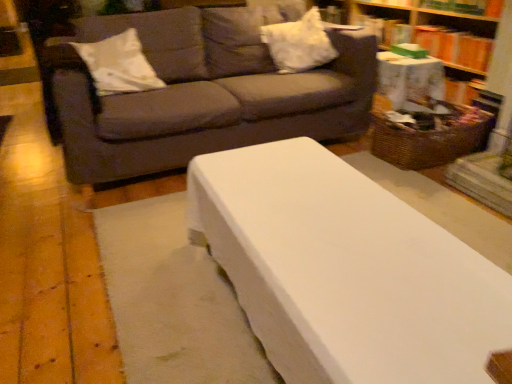
Question: Is point (482, 112) closer or farther from the camera than point (94, 66)?

Choices:
 (A) farther
 (B) closer

Answer: (A)

Question: Is woven brown basket at right wider or thinner than white soft pillow at upper left, which is the first pillow in left-to-right order?

Choices:
 (A) wide
 (B) thin

Answer: (A)

Question: Considering the real-world distances, which object is closest to the dark gray fabric couch at upper center?

Choices:
 (A) white soft pillow at upper left, which is the first pillow in left-to-right order
 (B) woven brown basket at right
 (C) orange cardboard book at upper right
 (D) wooden bookcase at right
 (E) white fabric pillow at upper center, the 2th pillow when ordered from left to right

Answer: (A)

Question: Which object is the farthest from the woven brown basket at right?

Choices:
 (A) dark gray fabric couch at upper center
 (B) white fabric pillow at upper center, the first pillow from the right
 (C) white soft pillow at upper left, the second pillow when ordered from right to left
 (D) wooden bookcase at right
 (E) orange cardboard book at upper right

Answer: (C)